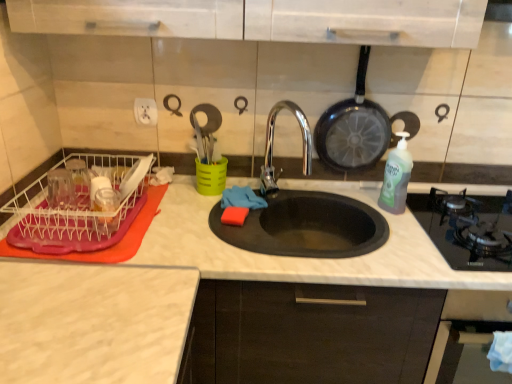
Question: From a real-world perspective, is black non-stick frying pan at upper right over transparent plastic dish rack at left?

Choices:
 (A) no
 (B) yes

Answer: (B)

Question: Is black non-stick frying pan at upper right aimed at transparent plastic dish rack at left?

Choices:
 (A) yes
 (B) no

Answer: (B)

Question: Does black non-stick frying pan at upper right have a smaller size compared to transparent plastic dish rack at left?

Choices:
 (A) no
 (B) yes

Answer: (B)

Question: Can you confirm if black non-stick frying pan at upper right is positioned to the right of transparent plastic dish rack at left?

Choices:
 (A) no
 (B) yes

Answer: (B)

Question: Would you say transparent plastic dish rack at left is part of black non-stick frying pan at upper right's contents?

Choices:
 (A) no
 (B) yes

Answer: (A)

Question: Can you confirm if black non-stick frying pan at upper right is bigger than transparent plastic dish rack at left?

Choices:
 (A) no
 (B) yes

Answer: (A)

Question: Considering the relative sizes of transparent plastic dish rack at left and black glass gas stove at right in the image provided, is transparent plastic dish rack at left thinner than black glass gas stove at right?

Choices:
 (A) yes
 (B) no

Answer: (A)

Question: From a real-world perspective, is transparent plastic dish rack at left positioned under black glass gas stove at right based on gravity?

Choices:
 (A) no
 (B) yes

Answer: (A)

Question: Is the depth of transparent plastic dish rack at left less than that of black glass gas stove at right?

Choices:
 (A) no
 (B) yes

Answer: (A)

Question: Is transparent plastic dish rack at left positioned with its back to black glass gas stove at right?

Choices:
 (A) yes
 (B) no

Answer: (B)

Question: Is transparent plastic dish rack at left shorter than black glass gas stove at right?

Choices:
 (A) yes
 (B) no

Answer: (B)

Question: From the image's perspective, is transparent plastic dish rack at left beneath black glass gas stove at right?

Choices:
 (A) yes
 (B) no

Answer: (B)

Question: Is black glass oven at lower right positioned beyond the bounds of black glass gas stove at right?

Choices:
 (A) yes
 (B) no

Answer: (A)